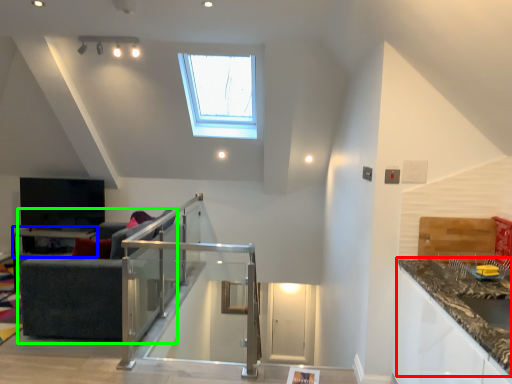
Question: Considering the real-world distances, which object is farthest from countertop (highlighted by a red box)? table (highlighted by a blue box) or studio couch (highlighted by a green box)?

Choices:
 (A) table
 (B) studio couch

Answer: (A)